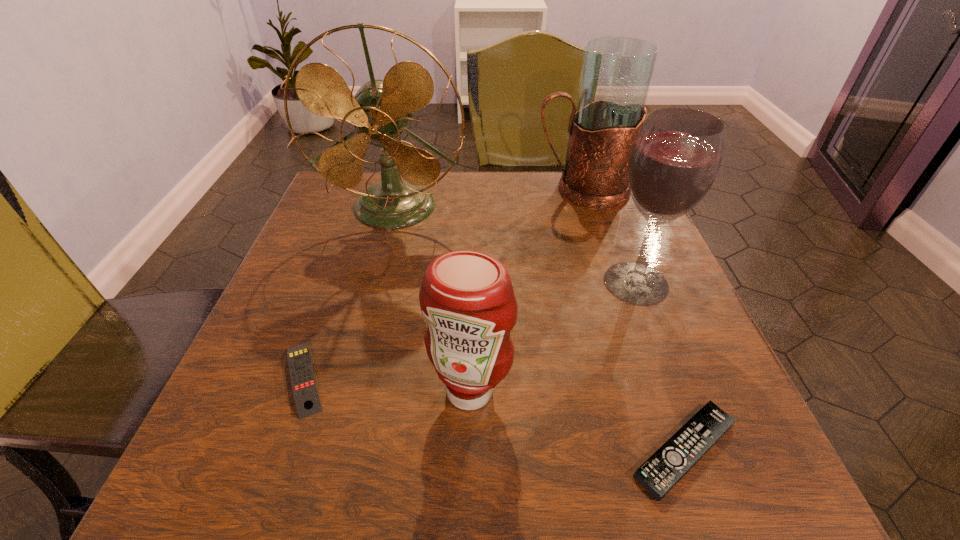
This screenshot has width=960, height=540. I want to click on the tallest object, so click(380, 110).

I want to click on pitcher, so click(616, 74).

The height and width of the screenshot is (540, 960). I want to click on alcohol, so click(x=675, y=159).

Locate an element on the screen. the third shortest object is located at coordinates (467, 297).

The image size is (960, 540). In order to click on the second shortest object in this screenshot , I will do `click(305, 392)`.

Locate an element on the screen. Image resolution: width=960 pixels, height=540 pixels. the left remote control is located at coordinates point(305,392).

Image resolution: width=960 pixels, height=540 pixels. What are the coordinates of `the shortest object` in the screenshot? It's located at (661, 472).

You are a GUI agent. You are given a task and a screenshot of the screen. Output one action in this format:
    pyautogui.click(x=<x>, y=<y>)
    Task: Click on the right remote control
    This screenshot has height=540, width=960.
    Given the screenshot: What is the action you would take?
    coord(661,472)

Identify the location of vacant area situated in front of the tallest object, directing air flow. This screenshot has height=540, width=960. (371, 299).

Where is `free region located with the handle on the side of the pitcher`? Image resolution: width=960 pixels, height=540 pixels. free region located with the handle on the side of the pitcher is located at coordinates (499, 191).